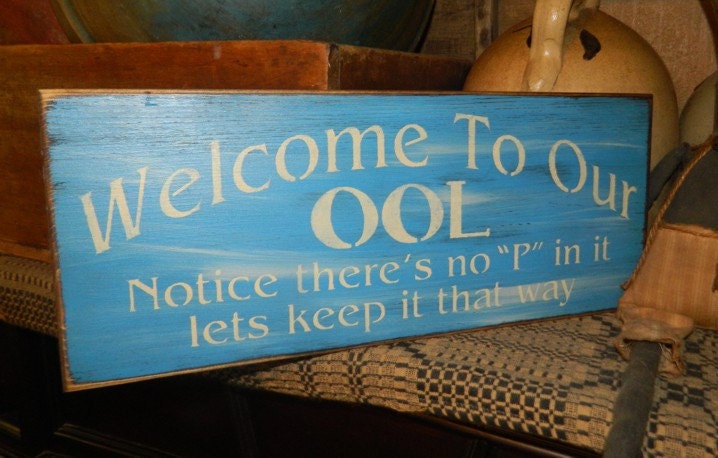
Where is `jugs`? The height and width of the screenshot is (458, 718). jugs is located at coordinates (610, 66).